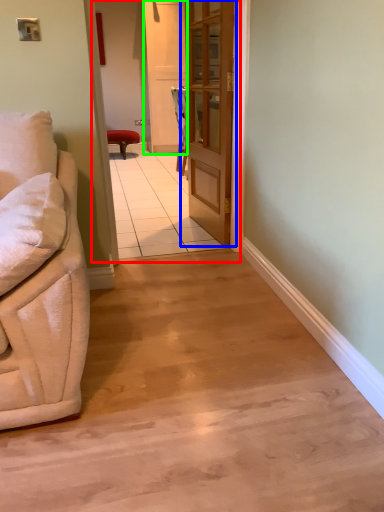
Question: Based on their relative distances, which object is farther from corridor (highlighted by a red box)? Choose from door (highlighted by a blue box) and screen door (highlighted by a green box).

Choices:
 (A) door
 (B) screen door

Answer: (A)